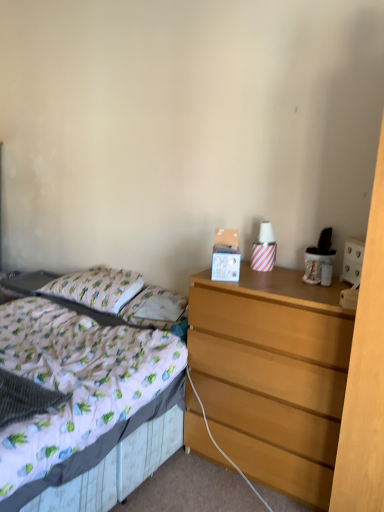
In order to face wooden chest of drawers at right, should I rotate leftwards or rightwards?

You should rotate right by 11.003 degrees.

This screenshot has height=512, width=384. What do you see at coordinates (272, 375) in the screenshot? I see `wooden chest of drawers at right` at bounding box center [272, 375].

Locate an element on the screen. cotton/cotton-like pillow at left, arranged as the 1th pillow when viewed from the left is located at coordinates (97, 288).

What are the coordinates of `white fabric pillow at center, the first pillow positioned from the right` in the screenshot? It's located at (144, 303).

What is the approximate height of white fabric bed at left?

26.58 inches.

In order to click on wooden chest of drawers at right in this screenshot , I will do point(272,375).

Is wooden chest of drawers at right inside white fabric bed at left?

No, wooden chest of drawers at right is not surrounded by white fabric bed at left.

From the image's perspective, is white fabric bed at left located above or below wooden chest of drawers at right?

From the image's perspective, white fabric bed at left appears below wooden chest of drawers at right.

Which object is wider, white fabric bed at left or wooden chest of drawers at right?

white fabric bed at left.

In terms of size, does white fabric bed at left appear bigger or smaller than wooden chest of drawers at right?

white fabric bed at left is bigger than wooden chest of drawers at right.

Which is behind, point (137, 297) or point (293, 465)?

The point (137, 297) is farther from the camera.

Which of these two, white fabric pillow at center, marked as the 2th pillow in a left-to-right arrangement, or wooden chest of drawers at right, is wider?

With larger width is wooden chest of drawers at right.

How different are the orientations of white fabric pillow at center, the first pillow positioned from the right, and wooden chest of drawers at right in degrees?

→ They differ by 6.13 degrees in their facing directions.

From a real-world perspective, who is located higher, white fabric pillow at center, marked as the 2th pillow in a left-to-right arrangement, or wooden chest of drawers at right?

From a 3D spatial view, white fabric pillow at center, marked as the 2th pillow in a left-to-right arrangement, is above.

From a real-world perspective, is white fabric bed at left positioned under cotton/cotton-like pillow at left, the second pillow viewed from the right, based on gravity?

Yes, from a real-world perspective, white fabric bed at left is beneath cotton/cotton-like pillow at left, the second pillow viewed from the right.

Is white fabric bed at left next to cotton/cotton-like pillow at left, the second pillow viewed from the right?

No, white fabric bed at left is not with cotton/cotton-like pillow at left, the second pillow viewed from the right.

In the scene shown: Which object is more forward, white fabric bed at left or cotton/cotton-like pillow at left, arranged as the 1th pillow when viewed from the left?

white fabric bed at left is closer to the camera.

Is white fabric bed at left to the right of cotton/cotton-like pillow at left, the second pillow viewed from the right, from the viewer's perspective?

Incorrect, white fabric bed at left is not on the right side of cotton/cotton-like pillow at left, the second pillow viewed from the right.

Is wooden chest of drawers at right a part of cotton/cotton-like pillow at left, arranged as the 1th pillow when viewed from the left?

No, wooden chest of drawers at right is not inside cotton/cotton-like pillow at left, arranged as the 1th pillow when viewed from the left.

Considering the relative sizes of cotton/cotton-like pillow at left, the second pillow viewed from the right, and wooden chest of drawers at right in the image provided, is cotton/cotton-like pillow at left, the second pillow viewed from the right, bigger than wooden chest of drawers at right?

Actually, cotton/cotton-like pillow at left, the second pillow viewed from the right, might be smaller than wooden chest of drawers at right.

From a real-world perspective, which object rests below the other?

In real-world perspective, wooden chest of drawers at right is lower.

Considering the positions of objects cotton/cotton-like pillow at left, arranged as the 1th pillow when viewed from the left, and wooden chest of drawers at right in the image provided, who is more to the right, cotton/cotton-like pillow at left, arranged as the 1th pillow when viewed from the left, or wooden chest of drawers at right?

wooden chest of drawers at right.

In terms of height, does wooden chest of drawers at right look taller or shorter compared to cotton/cotton-like pillow at left, arranged as the 1th pillow when viewed from the left?

Clearly, wooden chest of drawers at right is taller compared to cotton/cotton-like pillow at left, arranged as the 1th pillow when viewed from the left.

From the picture: From a real-world perspective, is wooden chest of drawers at right on cotton/cotton-like pillow at left, arranged as the 1th pillow when viewed from the left?

No, from a real-world perspective, wooden chest of drawers at right is not on top of cotton/cotton-like pillow at left, arranged as the 1th pillow when viewed from the left.

Is wooden chest of drawers at right in contact with cotton/cotton-like pillow at left, arranged as the 1th pillow when viewed from the left?

No, wooden chest of drawers at right is not making contact with cotton/cotton-like pillow at left, arranged as the 1th pillow when viewed from the left.

From the image's perspective, is wooden chest of drawers at right over cotton/cotton-like pillow at left, the second pillow viewed from the right?

No, from the image's perspective, wooden chest of drawers at right is not on top of cotton/cotton-like pillow at left, the second pillow viewed from the right.

From the image's perspective, which one is positioned higher, white fabric pillow at center, marked as the 2th pillow in a left-to-right arrangement, or white fabric bed at left?

white fabric pillow at center, marked as the 2th pillow in a left-to-right arrangement, appears higher in the image.

Is white fabric pillow at center, the first pillow positioned from the right, further to the viewer compared to white fabric bed at left?

Yes, white fabric pillow at center, the first pillow positioned from the right, is further from the viewer.

Consider the image. Which of these two, white fabric pillow at center, marked as the 2th pillow in a left-to-right arrangement, or white fabric bed at left, stands taller?

Standing taller between the two is white fabric bed at left.

Can we say white fabric pillow at center, marked as the 2th pillow in a left-to-right arrangement, lies outside white fabric bed at left?

Actually, white fabric pillow at center, marked as the 2th pillow in a left-to-right arrangement, is within white fabric bed at left.

Are white fabric pillow at center, marked as the 2th pillow in a left-to-right arrangement, and cotton/cotton-like pillow at left, arranged as the 1th pillow when viewed from the left, far apart?

That's not correct — white fabric pillow at center, marked as the 2th pillow in a left-to-right arrangement, is a little close to cotton/cotton-like pillow at left, arranged as the 1th pillow when viewed from the left.

Is white fabric pillow at center, marked as the 2th pillow in a left-to-right arrangement, aimed at cotton/cotton-like pillow at left, the second pillow viewed from the right?

No, white fabric pillow at center, marked as the 2th pillow in a left-to-right arrangement, is not facing towards cotton/cotton-like pillow at left, the second pillow viewed from the right.

Is white fabric pillow at center, the first pillow positioned from the right, at the left side of cotton/cotton-like pillow at left, arranged as the 1th pillow when viewed from the left?

No, white fabric pillow at center, the first pillow positioned from the right, is not to the left of cotton/cotton-like pillow at left, arranged as the 1th pillow when viewed from the left.

Is point (141, 307) positioned after point (87, 295)?

No, it is in front of (87, 295).

Locate an element on the screen. chest of drawers above the white fabric bed at left (from a real-world perspective) is located at coordinates (272, 375).

Image resolution: width=384 pixels, height=512 pixels. In the image, there is a white fabric pillow at center, marked as the 2th pillow in a left-to-right arrangement. In order to click on the chest of drawers below it (from a real-world perspective) in this screenshot , I will do `click(272, 375)`.

Based on their spatial positions, is cotton/cotton-like pillow at left, arranged as the 1th pillow when viewed from the left, or white fabric pillow at center, the first pillow positioned from the right, further from wooden chest of drawers at right?

Among the two, cotton/cotton-like pillow at left, arranged as the 1th pillow when viewed from the left, is located further to wooden chest of drawers at right.

When comparing their distances from white fabric pillow at center, the first pillow positioned from the right, does cotton/cotton-like pillow at left, the second pillow viewed from the right, or white fabric bed at left seem closer?

cotton/cotton-like pillow at left, the second pillow viewed from the right.

Looking at the image, which one is located closer to wooden chest of drawers at right, cotton/cotton-like pillow at left, the second pillow viewed from the right, or white fabric bed at left?

white fabric bed at left lies closer to wooden chest of drawers at right than the other object.

Consider the image. Estimate the real-world distances between objects in this image. Which object is further from cotton/cotton-like pillow at left, the second pillow viewed from the right, white fabric pillow at center, the first pillow positioned from the right, or wooden chest of drawers at right?

wooden chest of drawers at right lies further to cotton/cotton-like pillow at left, the second pillow viewed from the right, than the other object.

Estimate the real-world distances between objects in this image. Which object is further from white fabric pillow at center, the first pillow positioned from the right, white fabric bed at left or cotton/cotton-like pillow at left, arranged as the 1th pillow when viewed from the left?

white fabric bed at left lies further to white fabric pillow at center, the first pillow positioned from the right, than the other object.

Based on their spatial positions, is wooden chest of drawers at right or cotton/cotton-like pillow at left, the second pillow viewed from the right, further from white fabric bed at left?

cotton/cotton-like pillow at left, the second pillow viewed from the right, is further to white fabric bed at left.

Looking at the image, which one is located further to cotton/cotton-like pillow at left, arranged as the 1th pillow when viewed from the left, wooden chest of drawers at right or white fabric pillow at center, the first pillow positioned from the right?

wooden chest of drawers at right.

Which object lies nearer to the anchor point wooden chest of drawers at right, white fabric pillow at center, marked as the 2th pillow in a left-to-right arrangement, or white fabric bed at left?

Among the two, white fabric bed at left is located nearer to wooden chest of drawers at right.

Where is `the chest of drawers located between white fabric bed at left and white fabric pillow at center, marked as the 2th pillow in a left-to-right arrangement, in the depth direction`? the chest of drawers located between white fabric bed at left and white fabric pillow at center, marked as the 2th pillow in a left-to-right arrangement, in the depth direction is located at coordinates (272, 375).

What are the coordinates of `pillow situated between cotton/cotton-like pillow at left, the second pillow viewed from the right, and wooden chest of drawers at right from left to right` in the screenshot? It's located at (144, 303).

At what (x,y) coordinates should I click in order to perform the action: click on pillow positioned between white fabric bed at left and cotton/cotton-like pillow at left, the second pillow viewed from the right, from near to far. Please return your answer as a coordinate pair (x, y). The image size is (384, 512). Looking at the image, I should click on (144, 303).